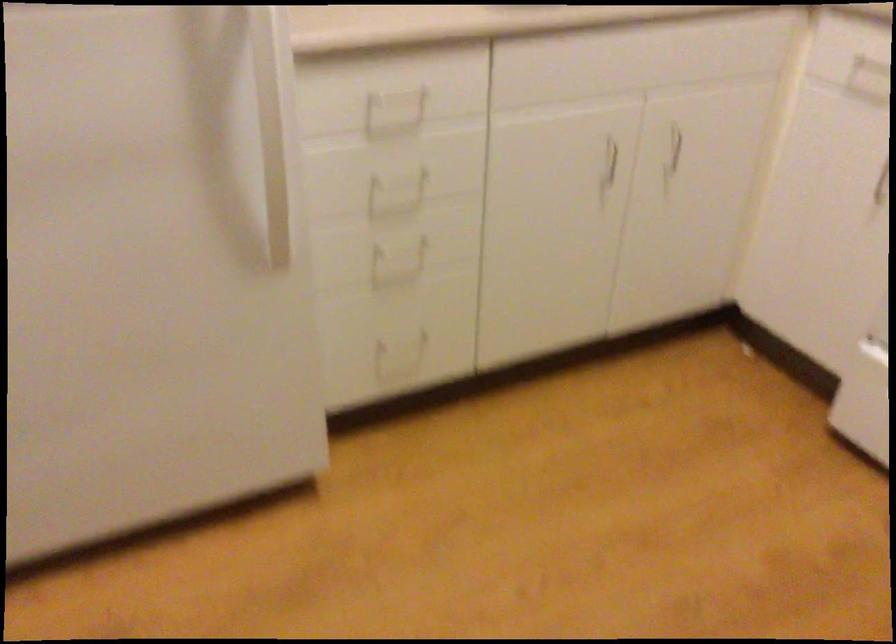
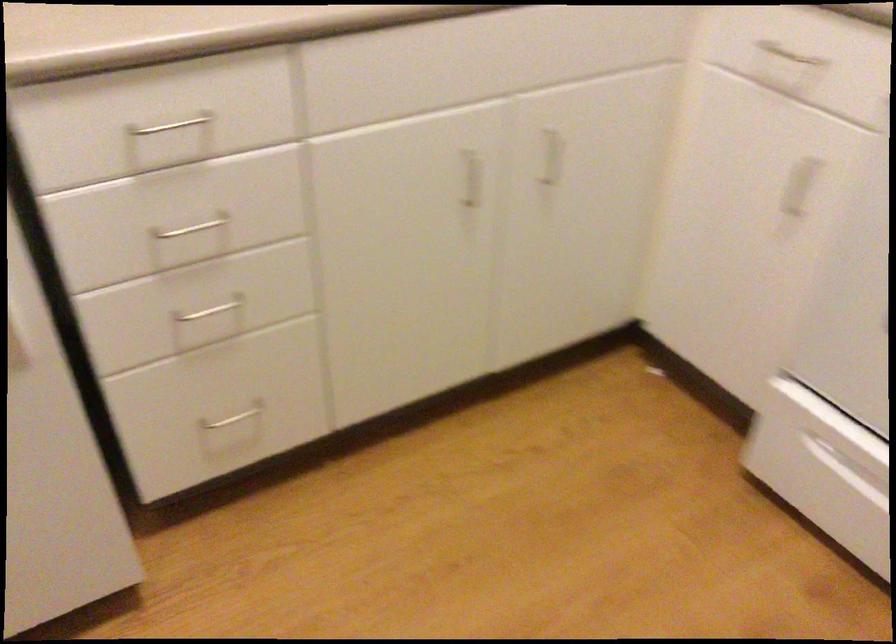
In the second image, find the point that corresponds to point 391,91 in the first image.

(170, 125)